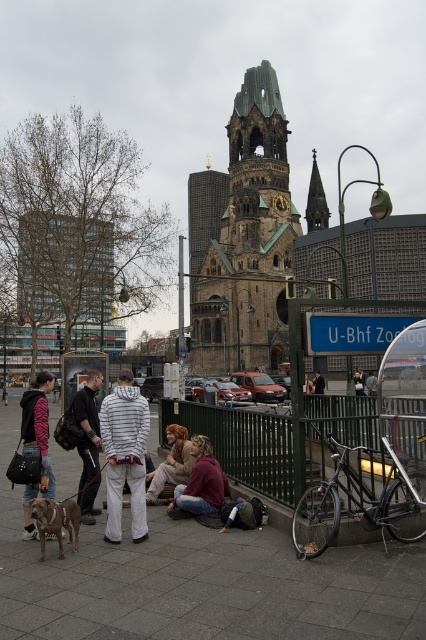
You are a pedestrian trying to cross the street near the subway station. You see the metallic bicycle at center and the zebra print hoodie at lower left. Which object is closer to the street?

The metallic bicycle at center is to the right of the zebra print hoodie at lower left, so the metallic bicycle at center is closer to the street.

You are a delivery person with a cart that is 3 meters wide. You need to navigate through the space between the jeans at center and brown hair at center in the public square. Can your cart fit through that space?

The distance between the jeans at center and brown hair at center is 2.87 meters. Since your cart is 3 meters wide, it cannot fit through the space between the jeans at center and brown hair at center as the available space is narrower than the cart.